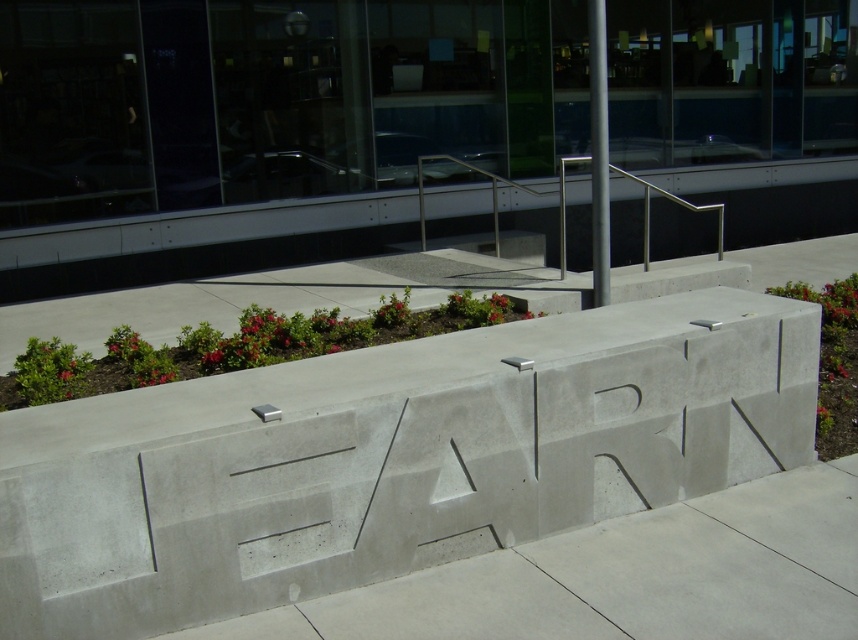
You are a delivery person with a cart that is 1.5 meters wide. You need to move from the gray concrete pavement at center to the concrete bench at upper center. Is there enough space between them for your cart to pass through?

The distance between the gray concrete pavement at center and the concrete bench at upper center is 7.08 meters, which is more than enough for your 1.5 meter wide cart to pass through.